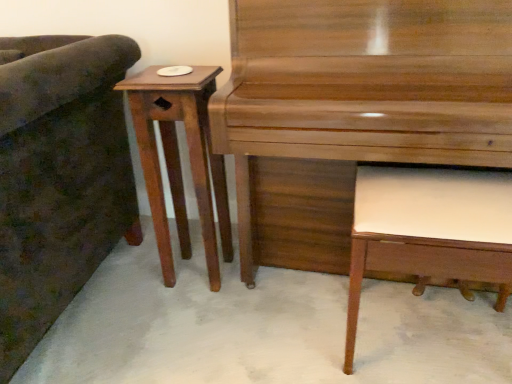
Find the location of a particular element. The width and height of the screenshot is (512, 384). empty space that is in between mahogany wood side table at left and white leather music stool at lower right is located at coordinates (293, 308).